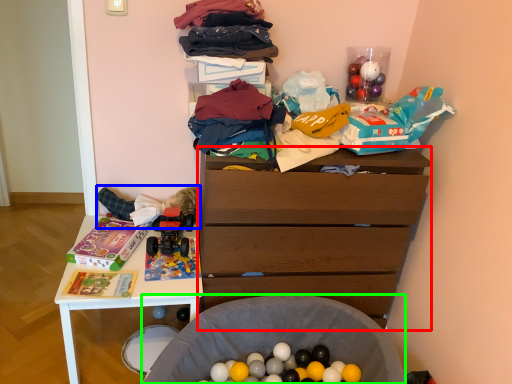
Question: Considering the real-world distances, which object is closest to chest of drawers (highlighted by a red box)? child (highlighted by a blue box) or waste (highlighted by a green box).

Choices:
 (A) child
 (B) waste

Answer: (B)